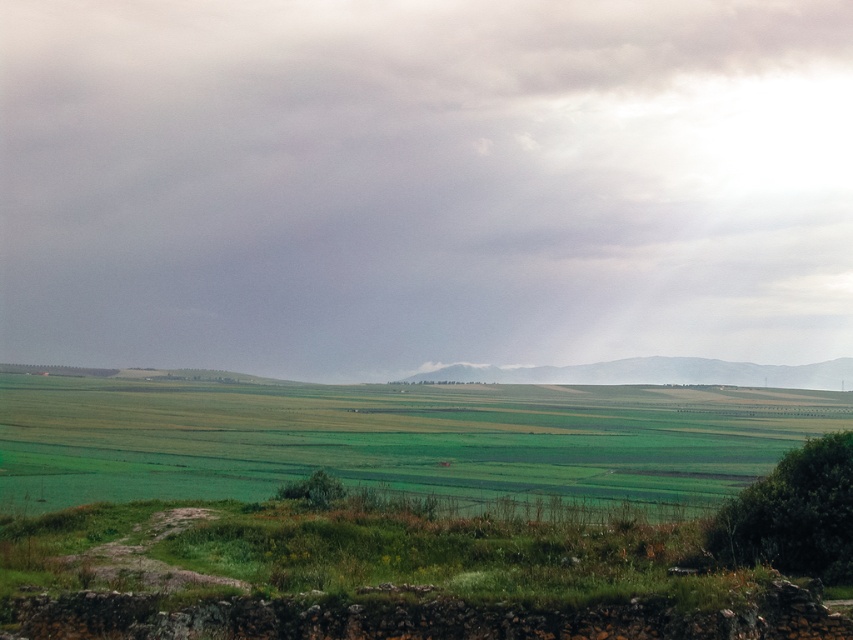
Which of these two, cloudy sky at upper center or green grassy field at lower center, stands shorter?

green grassy field at lower center

Does cloudy sky at upper center have a greater width compared to green grassy field at lower center?

Correct, the width of cloudy sky at upper center exceeds that of green grassy field at lower center.

The width and height of the screenshot is (853, 640). I want to click on cloudy sky at upper center, so click(422, 182).

Can you confirm if green grassy field at lower center is positioned below green grassy hillside at center?

Yes.

The image size is (853, 640). I want to click on green grassy field at lower center, so click(x=392, y=438).

Is cloudy sky at upper center to the right of green grassy hillside at center from the viewer's perspective?

In fact, cloudy sky at upper center is to the left of green grassy hillside at center.

Describe the element at coordinates (422, 182) in the screenshot. I see `cloudy sky at upper center` at that location.

At what (x,y) coordinates should I click in order to perform the action: click on cloudy sky at upper center. Please return your answer as a coordinate pair (x, y). Looking at the image, I should click on point(422,182).